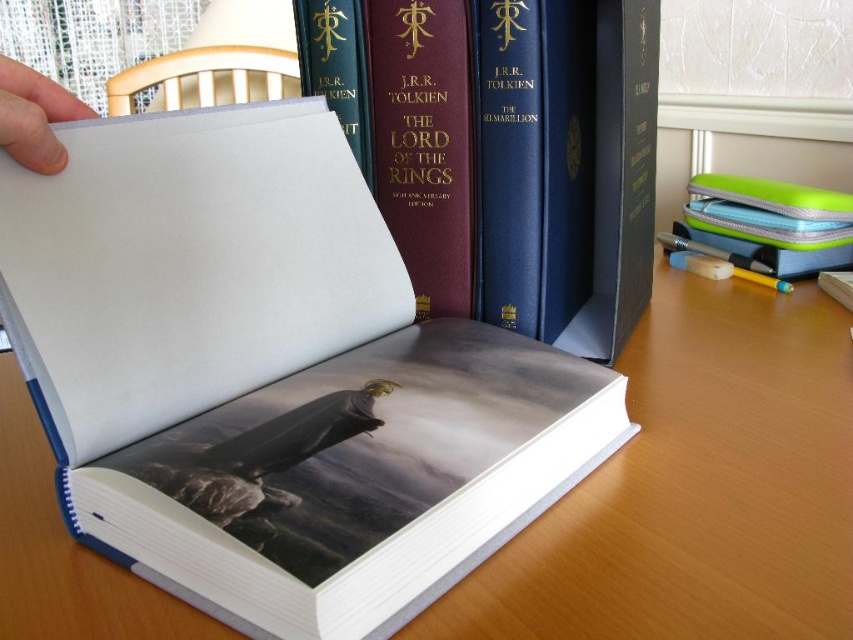
Question: Among these objects, which one is farthest from the camera?

Choices:
 (A) hardcover book at center
 (B) wooden table at center
 (C) white paper at upper left

Answer: (A)

Question: Considering the real-world distances, which object is farthest from the wooden table at center?

Choices:
 (A) white paper at upper left
 (B) hardcover book at center

Answer: (A)

Question: Can you confirm if wooden table at center is positioned above hardcover book at center?

Choices:
 (A) no
 (B) yes

Answer: (A)

Question: Is hardcover book at center above white paper at upper left?

Choices:
 (A) no
 (B) yes

Answer: (B)

Question: From the image, what is the correct spatial relationship of hardcover book at center in relation to white paper at upper left?

Choices:
 (A) right
 (B) left

Answer: (A)

Question: Among these objects, which one is nearest to the camera?

Choices:
 (A) hardcover book at center
 (B) white paper at upper left
 (C) wooden table at center

Answer: (C)